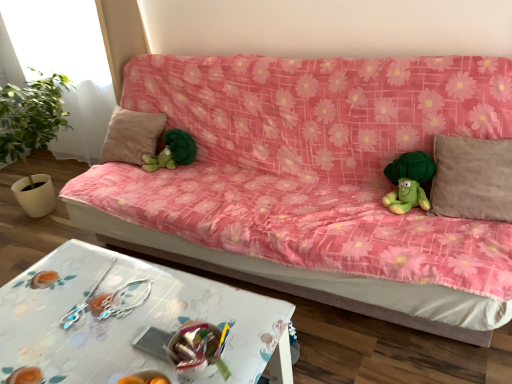
Find the location of `spots to the right of silver metallic earrings at lower center`. spots to the right of silver metallic earrings at lower center is located at coordinates (148, 287).